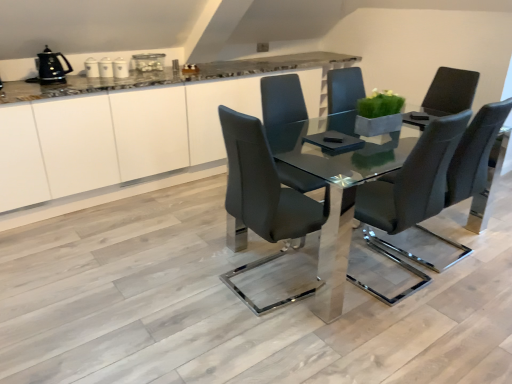
You are a GUI agent. You are given a task and a screenshot of the screen. Output one action in this format:
    pyautogui.click(x=<x>, y=<y>)
    Task: Click on the free space that is to the left of matte black chair at center, arranged as the first chair when viewed from the left
    This screenshot has width=512, height=384.
    Given the screenshot: What is the action you would take?
    pyautogui.click(x=186, y=280)